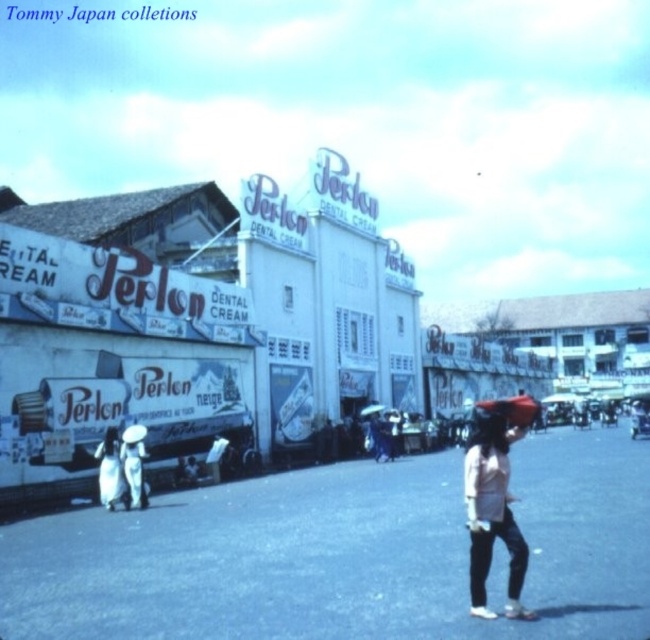
Question: Is white matte shirt at center in front of white cotton dress at lower left?

Choices:
 (A) yes
 (B) no

Answer: (A)

Question: Does white matte shirt at center appear over white cotton dress at lower left?

Choices:
 (A) no
 (B) yes

Answer: (B)

Question: Can you confirm if white matte shirt at center is thinner than white cotton dress at lower left?

Choices:
 (A) yes
 (B) no

Answer: (B)

Question: Among these objects, which one is nearest to the camera?

Choices:
 (A) white matte shirt at center
 (B) white cotton dress at lower left

Answer: (A)